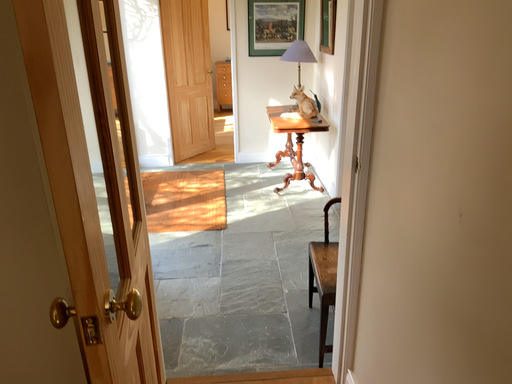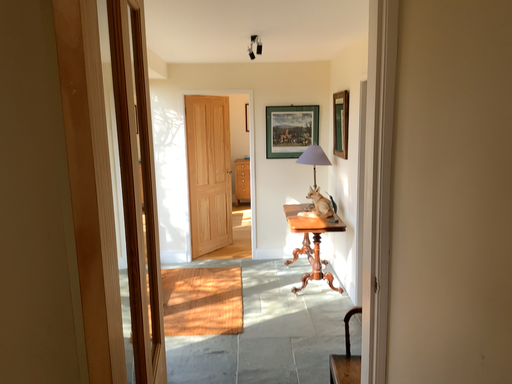
Question: How did the camera likely rotate when shooting the video?

Choices:
 (A) rotated downward
 (B) rotated upward

Answer: (B)